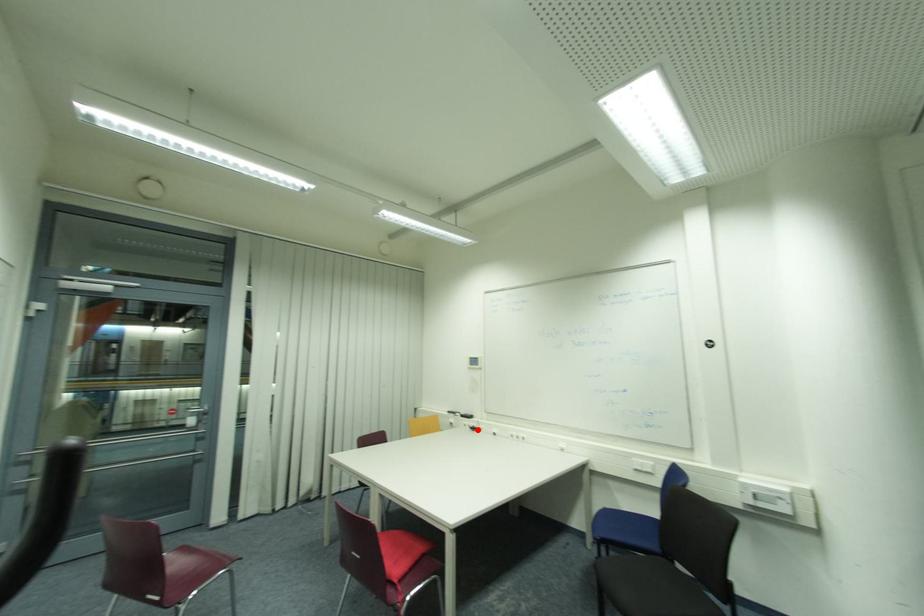
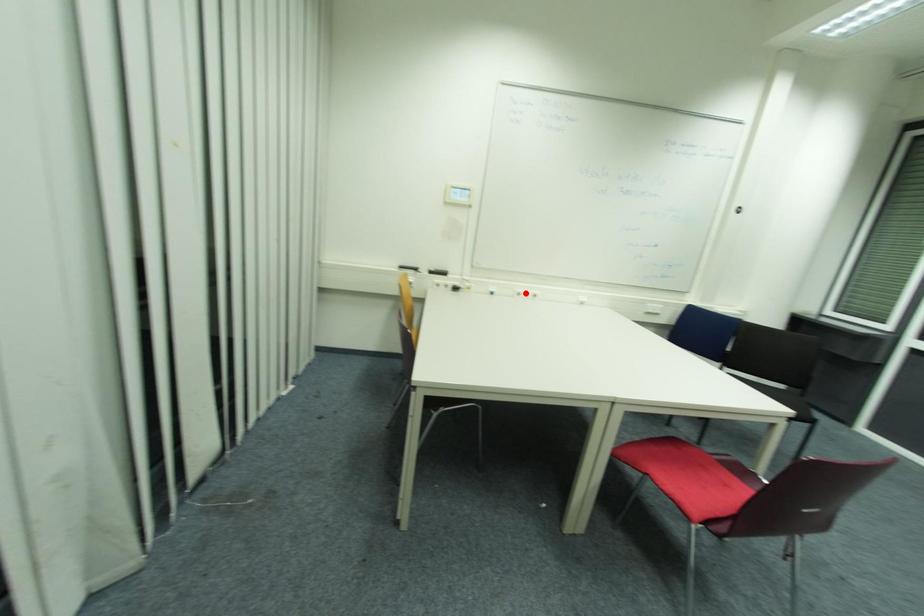
I am providing you with two images of the same scene from different viewpoints. A red point is marked on the first image and another point is marked on the second image. Do the highlighted points in image1 and image2 indicate the same real-world spot?

No